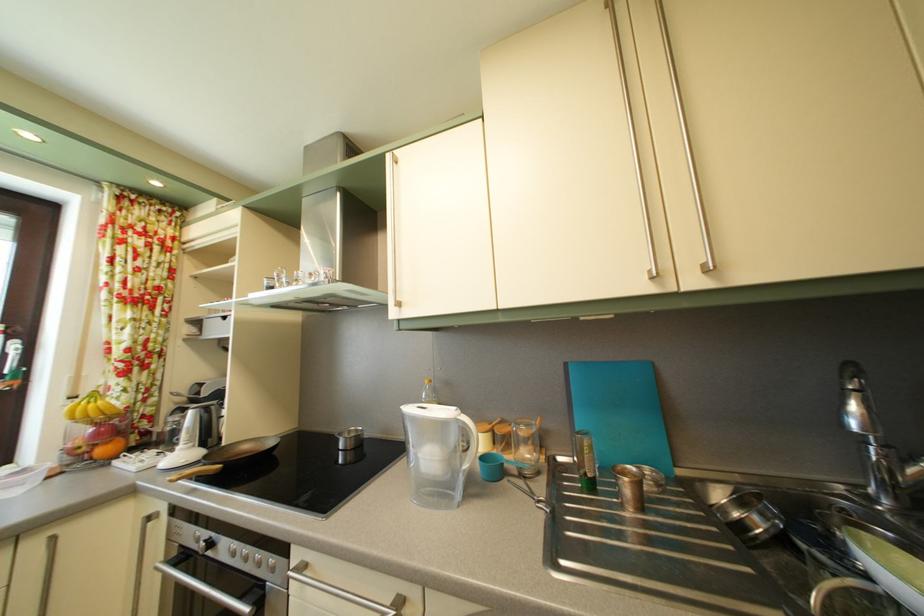
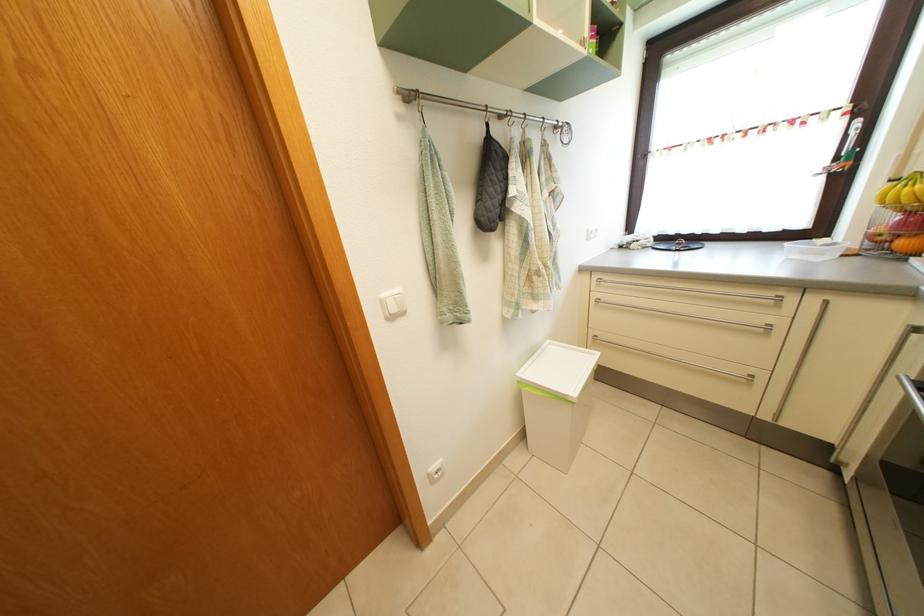
In the second image, find the point that corresponds to (111,458) in the first image.

(910, 252)